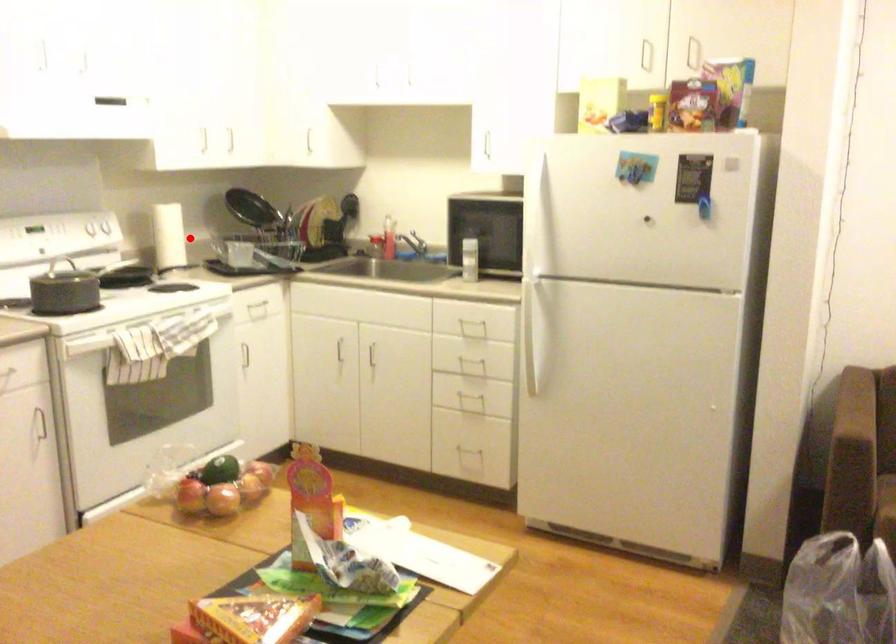
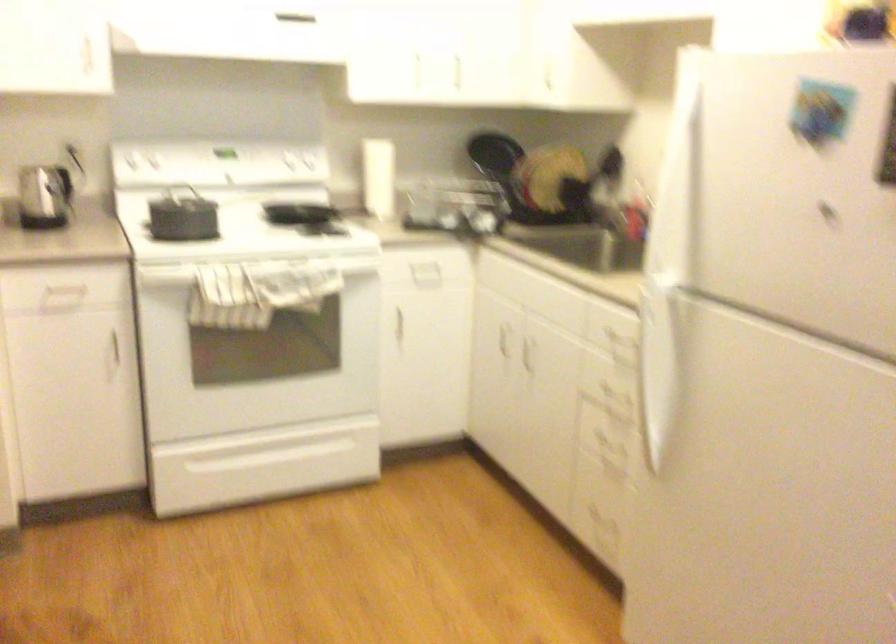
Where in the second image is the point corresponding to the highlighted location from the first image?

(377, 178)